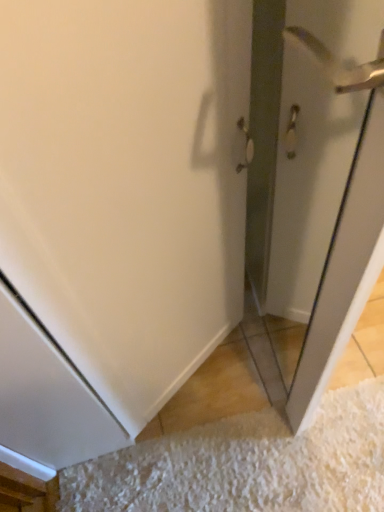
Question: Could white textured doormat at lower right be considered to be inside polished silver door handle at upper right?

Choices:
 (A) yes
 (B) no

Answer: (B)

Question: From a real-world perspective, is polished silver door handle at upper right located higher than white textured doormat at lower right?

Choices:
 (A) yes
 (B) no

Answer: (A)

Question: Is polished silver door handle at upper right not within white textured doormat at lower right?

Choices:
 (A) yes
 (B) no

Answer: (A)

Question: Is polished silver door handle at upper right to the right of white textured doormat at lower right from the viewer's perspective?

Choices:
 (A) yes
 (B) no

Answer: (A)

Question: From the image's perspective, is polished silver door handle at upper right over white textured doormat at lower right?

Choices:
 (A) no
 (B) yes

Answer: (B)

Question: Does polished silver door handle at upper right have a greater height compared to white textured doormat at lower right?

Choices:
 (A) yes
 (B) no

Answer: (A)

Question: Is clear glass screen door at right next to polished silver door handle at upper right?

Choices:
 (A) yes
 (B) no

Answer: (B)

Question: From the image's perspective, is clear glass screen door at right located above polished silver door handle at upper right?

Choices:
 (A) no
 (B) yes

Answer: (A)

Question: Considering the relative positions of clear glass screen door at right and polished silver door handle at upper right in the image provided, is clear glass screen door at right to the right of polished silver door handle at upper right from the viewer's perspective?

Choices:
 (A) yes
 (B) no

Answer: (B)

Question: From the image's perspective, does clear glass screen door at right appear lower than polished silver door handle at upper right?

Choices:
 (A) no
 (B) yes

Answer: (B)

Question: Can you confirm if clear glass screen door at right is shorter than polished silver door handle at upper right?

Choices:
 (A) yes
 (B) no

Answer: (B)

Question: Could polished silver door handle at upper right be considered to be inside clear glass screen door at right?

Choices:
 (A) yes
 (B) no

Answer: (B)

Question: Is white textured doormat at lower right completely or partially inside clear glass screen door at right?

Choices:
 (A) no
 (B) yes

Answer: (A)